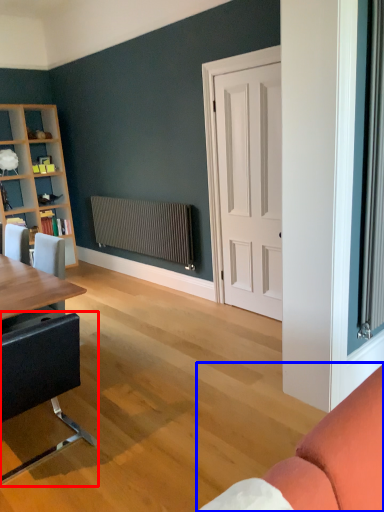
Question: Which of the following is the closest to the observer, chair (highlighted by a red box) or studio couch (highlighted by a blue box)?

Choices:
 (A) chair
 (B) studio couch

Answer: (B)